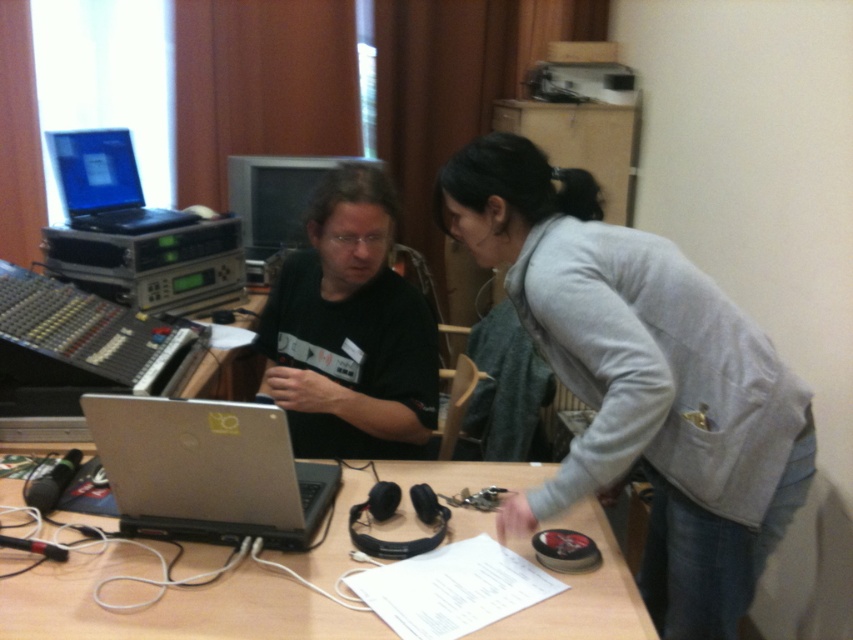
You are a delivery person who needs to place a 2.5 feet long package on the table without moving any items. Is there enough space between the gray fabric jacket at center and the edge of the table?

The gray fabric jacket at center is 3.84 feet from the camera. Since the package is 2.5 feet long, there is sufficient space between the jacket and the table edge to place it without moving other items.

You are setting up a workspace and need to place both the wooden table at center and the matte black laptop at upper left. Based on their sizes, which object should you place first to ensure there is enough space?

The wooden table at center is wider than the matte black laptop at upper left, so you should place the wooden table at center first to ensure there is enough space for both objects.